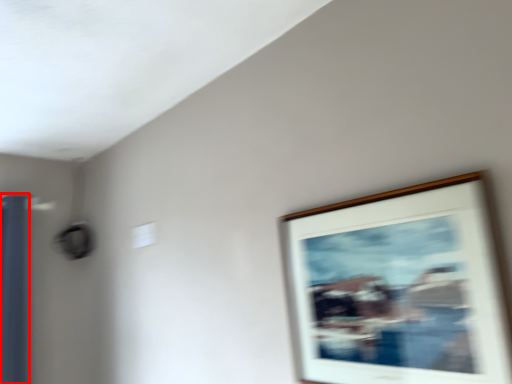
Question: Observing the image, what is the correct spatial positioning of curtain (annotated by the red box) in reference to picture frame?

Choices:
 (A) left
 (B) right

Answer: (A)